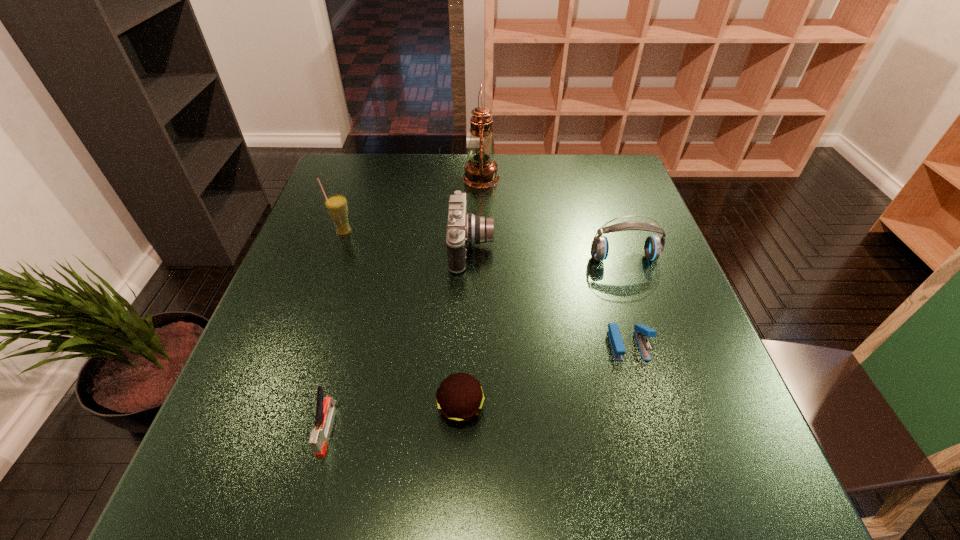
The image size is (960, 540). Identify the location of stapler that is at the right edge. (640, 330).

Locate an element on the screen. vacant region at the far edge of the desktop is located at coordinates (428, 178).

You are a GUI agent. You are given a task and a screenshot of the screen. Output one action in this format:
    pyautogui.click(x=<x>, y=<y>)
    Task: Click on the vacant space at the left edge of the desktop
    This screenshot has width=960, height=540.
    Given the screenshot: What is the action you would take?
    pyautogui.click(x=319, y=351)

The image size is (960, 540). Find the location of `free space at the right edge of the desktop`. free space at the right edge of the desktop is located at coordinates (652, 273).

The width and height of the screenshot is (960, 540). Identify the location of vacant area at the far left corner of the desktop. (326, 189).

This screenshot has height=540, width=960. I want to click on vacant region at the far right corner of the desktop, so [627, 180].

In the image, there is a desktop. What are the coordinates of `vacant space at the near right corner` in the screenshot? It's located at (707, 471).

You are a GUI agent. You are given a task and a screenshot of the screen. Output one action in this format:
    pyautogui.click(x=<x>, y=<y>)
    Task: Click on the vacant area that lies between the camera and the headset
    This screenshot has height=540, width=960.
    Given the screenshot: What is the action you would take?
    pyautogui.click(x=547, y=253)

At what (x,y) coordinates should I click in order to perform the action: click on free space between the camera and the patty. Please return your answer as a coordinate pair (x, y). Looking at the image, I should click on (466, 328).

Locate an element on the screen. The height and width of the screenshot is (540, 960). vacant space that is in between the farther stapler and the headset is located at coordinates (626, 301).